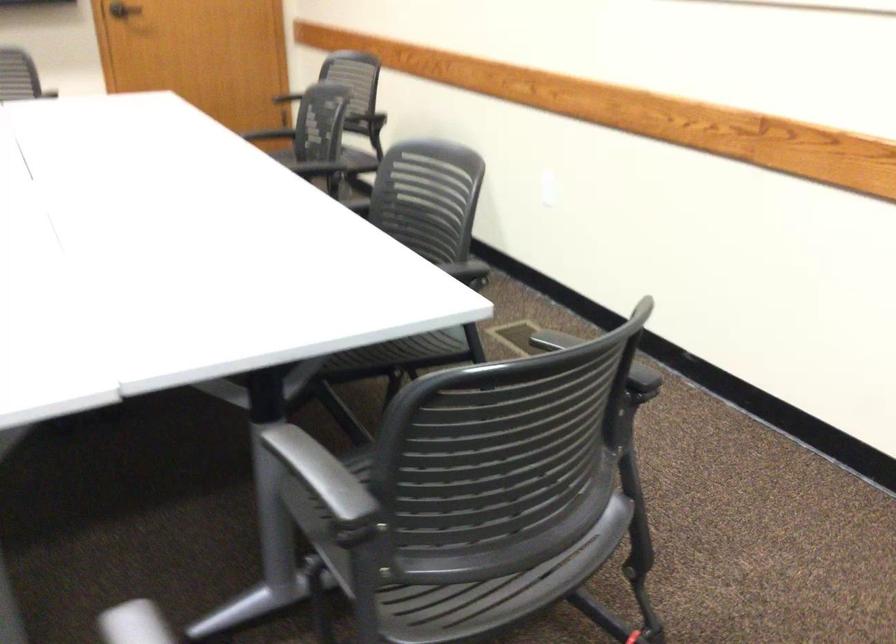
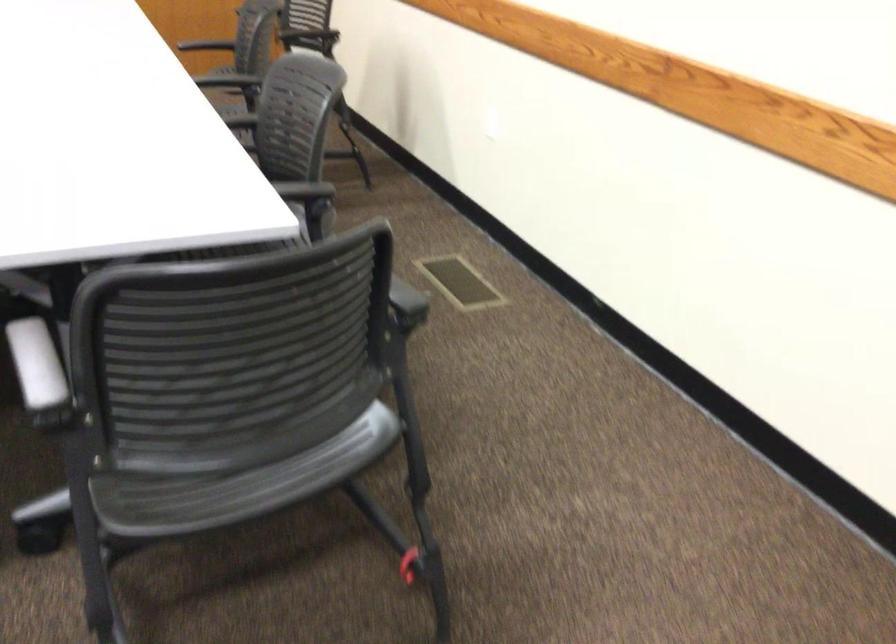
Question: The images are taken continuously from a first-person perspective. In which direction are you moving?

Choices:
 (A) Left
 (B) Right
 (C) Forward
 (D) Backward

Answer: (B)